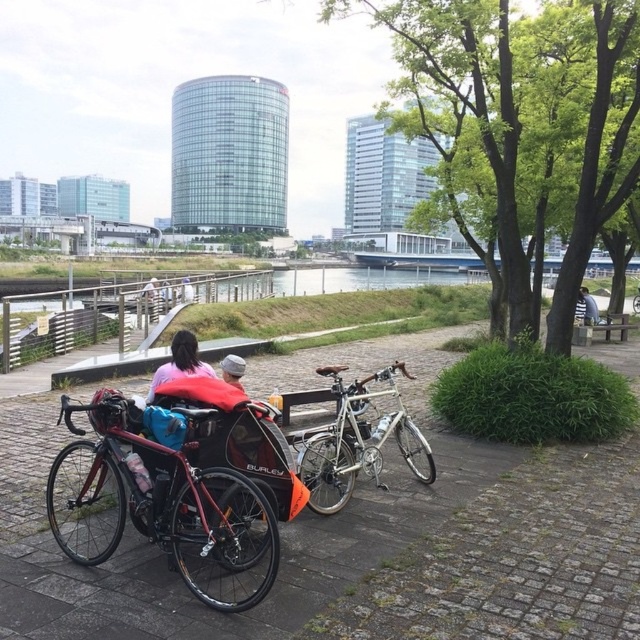
Question: Which is nearer to the gray knit cap at center?

Choices:
 (A) light blue fabric at center
 (B) silver metallic bicycle at center

Answer: (B)

Question: Which object appears closest to the camera in this image?

Choices:
 (A) light blue fabric at center
 (B) pink fabric at center
 (C) silver metallic bicycle at center
 (D) shiny metallic bicycle at center

Answer: (D)

Question: Which of the following is the farthest from the observer?

Choices:
 (A) (168, 369)
 (B) (330, 435)
 (C) (582, 300)
 (D) (180, 280)

Answer: (D)

Question: Does shiny metallic bicycle at center appear over blue fabric backpack at center?

Choices:
 (A) yes
 (B) no

Answer: (B)

Question: Does pink fabric at center come in front of light blue fabric at center?

Choices:
 (A) yes
 (B) no

Answer: (A)

Question: Is blue fabric backpack at center positioned behind light blue fabric at center?

Choices:
 (A) yes
 (B) no

Answer: (B)